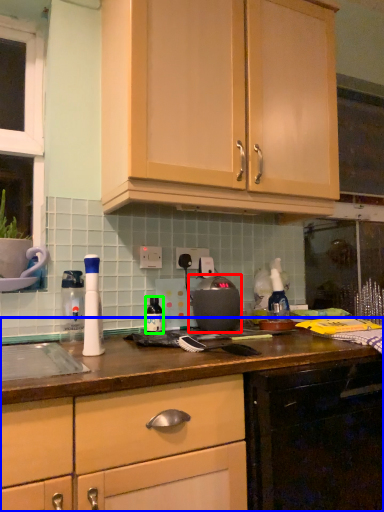
Question: Which object is positioned farthest from appliance (highlighted by a red box)? Select from cabinetry (highlighted by a blue box) and bottle (highlighted by a green box).

Choices:
 (A) cabinetry
 (B) bottle

Answer: (A)